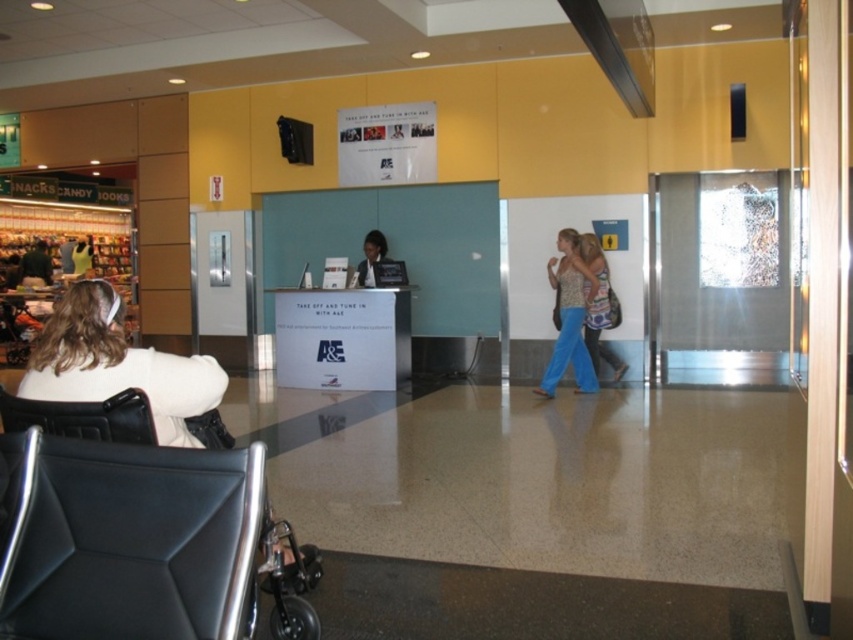
Consider the image. Is patterned fabric dress at center to the right of matte black laptop at center from the viewer's perspective?

Correct, you'll find patterned fabric dress at center to the right of matte black laptop at center.

Consider the image. Who is higher up, patterned fabric dress at center or matte black laptop at center?

matte black laptop at center

Is point (606, 288) positioned after point (364, 244)?

That is False.

I want to click on patterned fabric dress at center, so click(x=599, y=307).

Which of these two, black leather swivel chair at lower left or patterned fabric dress at center, stands taller?

Standing taller between the two is patterned fabric dress at center.

Does point (229, 545) come farther from viewer compared to point (595, 259)?

No, (229, 545) is closer to viewer.

Between point (33, 524) and point (613, 321), which one is positioned behind?

Point (613, 321)

This screenshot has height=640, width=853. Identify the location of black leather swivel chair at lower left. (136, 541).

Is black leather chair at lower left smaller than patterned fabric top at center?

Indeed, black leather chair at lower left has a smaller size compared to patterned fabric top at center.

Is black leather chair at lower left in front of patterned fabric top at center?

Yes, it is in front of patterned fabric top at center.

Is point (3, 401) positioned after point (596, 285)?

No, it is not.

Image resolution: width=853 pixels, height=640 pixels. I want to click on black leather chair at lower left, so click(x=83, y=417).